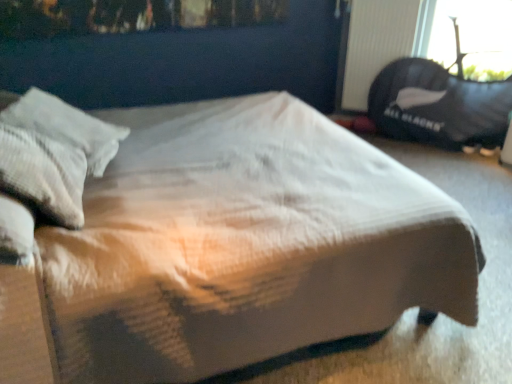
Question: Does black plastic radiator at upper right have a lesser height compared to black fabric bean bag at upper right?

Choices:
 (A) yes
 (B) no

Answer: (A)

Question: Are black plastic radiator at upper right and black fabric bean bag at upper right making contact?

Choices:
 (A) no
 (B) yes

Answer: (A)

Question: From a real-world perspective, is black plastic radiator at upper right under black fabric bean bag at upper right?

Choices:
 (A) no
 (B) yes

Answer: (A)

Question: Does black plastic radiator at upper right have a lesser width compared to black fabric bean bag at upper right?

Choices:
 (A) no
 (B) yes

Answer: (B)

Question: Does black plastic radiator at upper right come behind black fabric bean bag at upper right?

Choices:
 (A) no
 (B) yes

Answer: (B)

Question: Is black fabric bean bag at upper right at the back of black plastic radiator at upper right?

Choices:
 (A) no
 (B) yes

Answer: (A)

Question: Does black fabric bean bag at upper right have a smaller size compared to white quilted fabric bed at center?

Choices:
 (A) yes
 (B) no

Answer: (A)

Question: Considering the relative sizes of black fabric bean bag at upper right and white quilted fabric bed at center in the image provided, is black fabric bean bag at upper right taller than white quilted fabric bed at center?

Choices:
 (A) yes
 (B) no

Answer: (B)

Question: Is black fabric bean bag at upper right thinner than white quilted fabric bed at center?

Choices:
 (A) yes
 (B) no

Answer: (A)

Question: Could you tell me if black fabric bean bag at upper right is turned towards white quilted fabric bed at center?

Choices:
 (A) no
 (B) yes

Answer: (B)

Question: Considering the relative sizes of black fabric bean bag at upper right and white quilted fabric bed at center in the image provided, is black fabric bean bag at upper right wider than white quilted fabric bed at center?

Choices:
 (A) yes
 (B) no

Answer: (B)

Question: From the image's perspective, is black fabric bean bag at upper right below white quilted fabric bed at center?

Choices:
 (A) no
 (B) yes

Answer: (A)

Question: Does black plastic radiator at upper right have a lesser width compared to white quilted fabric bed at center?

Choices:
 (A) yes
 (B) no

Answer: (A)